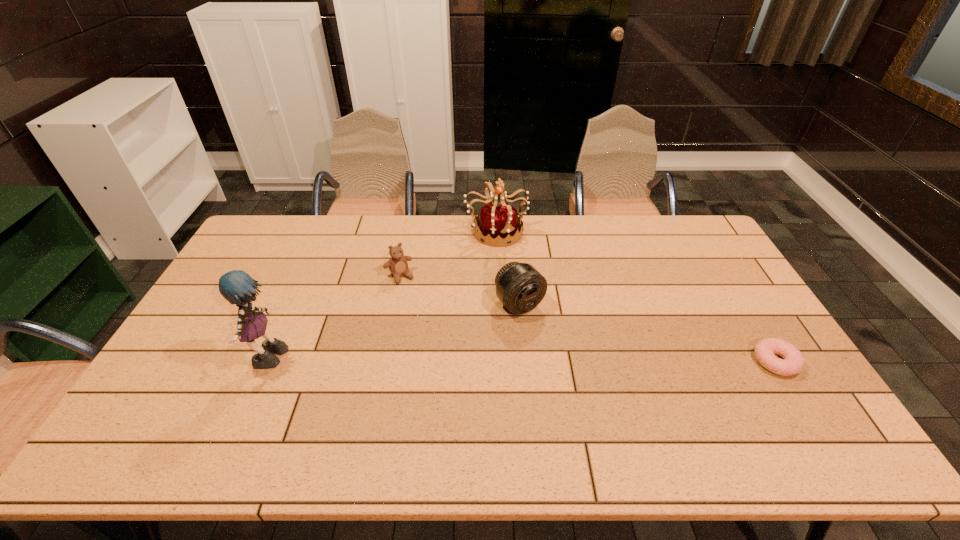
Image resolution: width=960 pixels, height=540 pixels. I want to click on free space on the desktop that is between the rag doll and the rightmost object and is positioned on the front-facing side of the teddy bear, so click(451, 362).

You are a GUI agent. You are given a task and a screenshot of the screen. Output one action in this format:
    pyautogui.click(x=<x>, y=<y>)
    Task: Click on the vacant space on the desktop that is between the rag doll and the shortest object and is positioned on the front-facing side of the third nearest object
    The height and width of the screenshot is (540, 960).
    Given the screenshot: What is the action you would take?
    pyautogui.click(x=573, y=362)

The width and height of the screenshot is (960, 540). In order to click on free spot on the desktop that is between the tallest object and the doughnut and is positioned on the front-facing side of the tiara in this screenshot , I will do `click(589, 362)`.